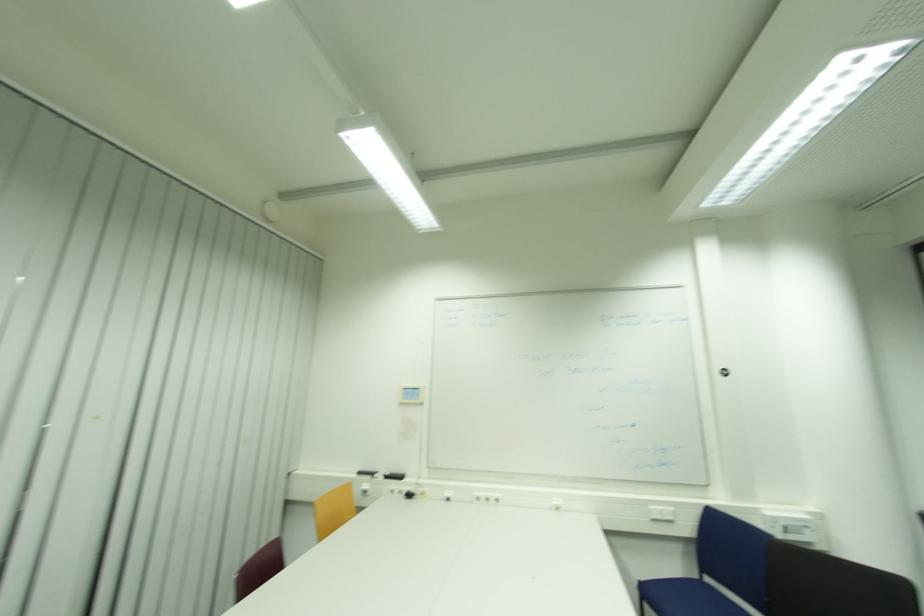
Find the location of a particular element. blue chair sitting surface is located at coordinates (675, 596).